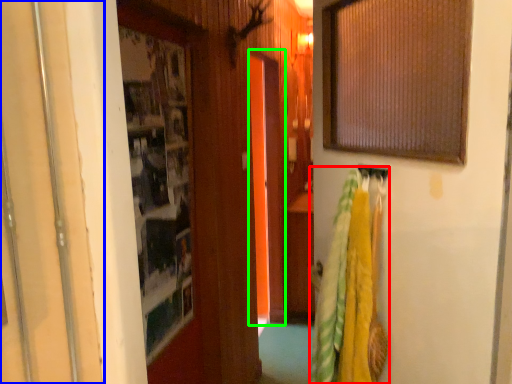
Question: Which is nearer to the laundry (highlighted by a red box)? door (highlighted by a blue box) or screen door (highlighted by a green box).

Choices:
 (A) door
 (B) screen door

Answer: (A)